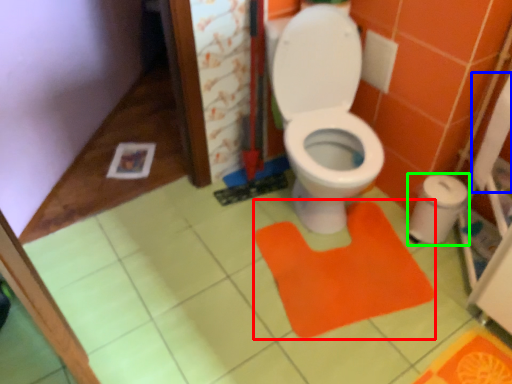
Question: Considering the real-world distances, which object is farthest from doormat (highlighted by a red box)? toilet paper (highlighted by a blue box) or potty (highlighted by a green box)?

Choices:
 (A) toilet paper
 (B) potty

Answer: (A)